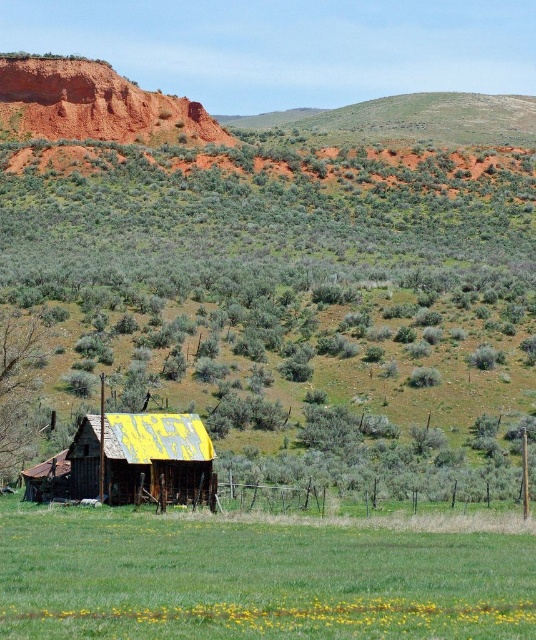
Does green grassy field at lower center appear under rusty corrugated metal hut at lower left?

Indeed, green grassy field at lower center is positioned under rusty corrugated metal hut at lower left.

Where is `green grassy field at lower center`? The height and width of the screenshot is (640, 536). green grassy field at lower center is located at coordinates (254, 579).

Where is `green grassy field at lower center`? The width and height of the screenshot is (536, 640). green grassy field at lower center is located at coordinates (254, 579).